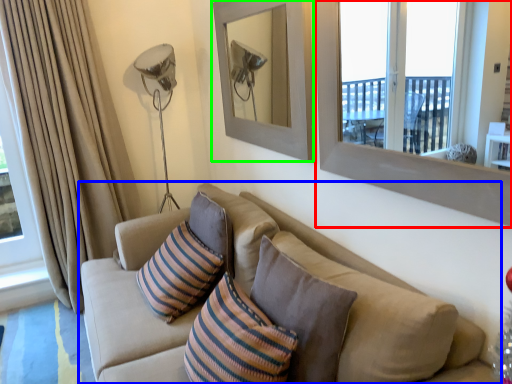
Question: Which is nearer to the window frame (highlighted by a red box)? studio couch (highlighted by a blue box) or picture frame (highlighted by a green box).

Choices:
 (A) studio couch
 (B) picture frame

Answer: (A)